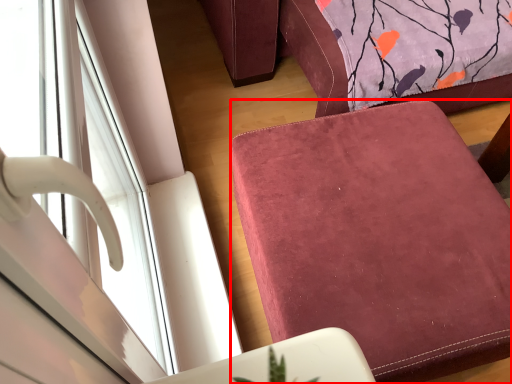
Question: From the image's perspective, considering the relative positions of furniture (annotated by the red box) and window in the image provided, where is furniture (annotated by the red box) located with respect to the staircase?

Choices:
 (A) above
 (B) below

Answer: (B)